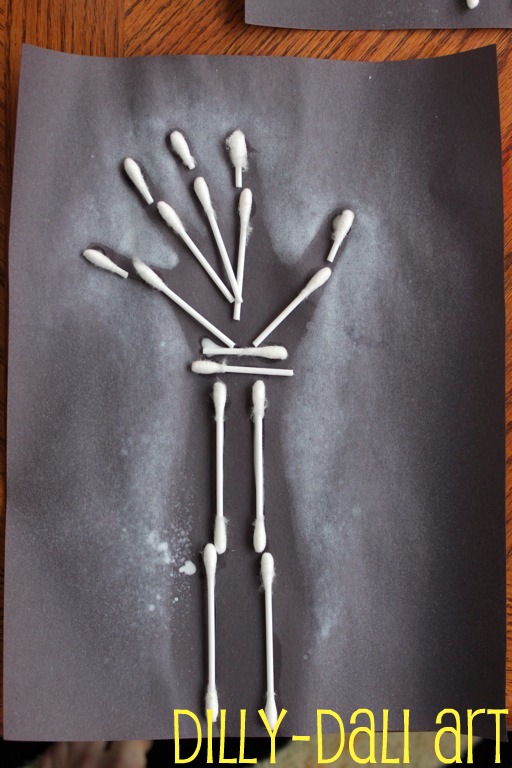
This screenshot has width=512, height=768. What are the coordinates of `wooden surface` in the screenshot? It's located at (185, 25).